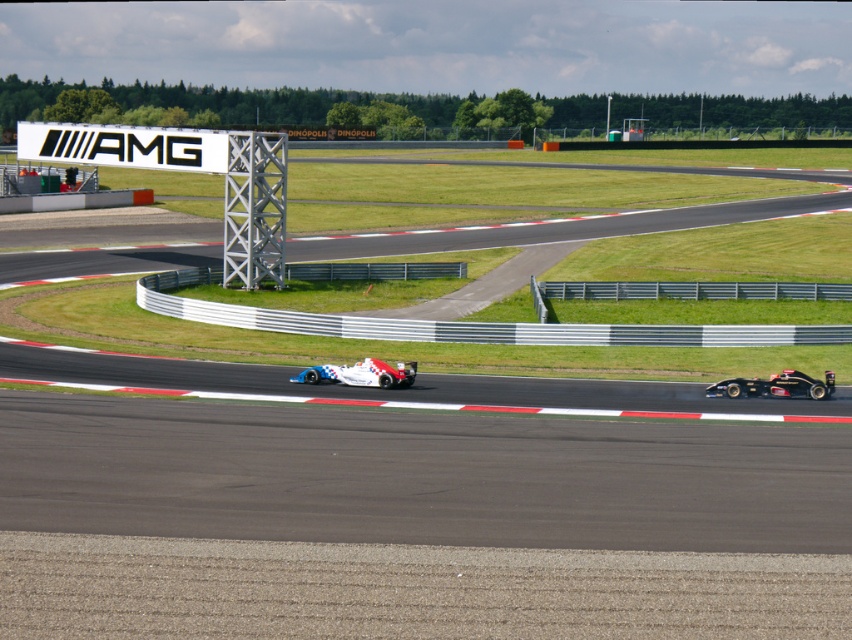
You are a race car driver in the white and blue race car at left. You need to reach a checkpoint located at point (x=775, y=385). Which direction should you turn to head towards the checkpoint?

The point (x=775, y=385) is located on the black carbon fiber race car at right. To reach the checkpoint, you should turn towards the black carbon fiber race car at right as the checkpoint is positioned on it.

You are a race official at the track. You need to determine if the black carbon fiber race car at right can fit through a narrow tunnel entrance that is designed to accommodate the white glossy race car at center. Based on their sizes, what would you advise?

The black carbon fiber race car at right has a smaller size compared to the white glossy race car at center, so it should fit through the tunnel entrance designed for the white glossy race car at center without any issues.

You are a race engineer analyzing the positions of the cars on the track. Given that the coordinate system starts at the bottom left corner of the image, can you determine which car is positioned further to the right between the black carbon fiber race car at right and the white and blue car on the left?

The black carbon fiber race car at right is located at point 0.603 in the x coordinate, which indicates it is positioned further to the right compared to the white and blue car on the left.